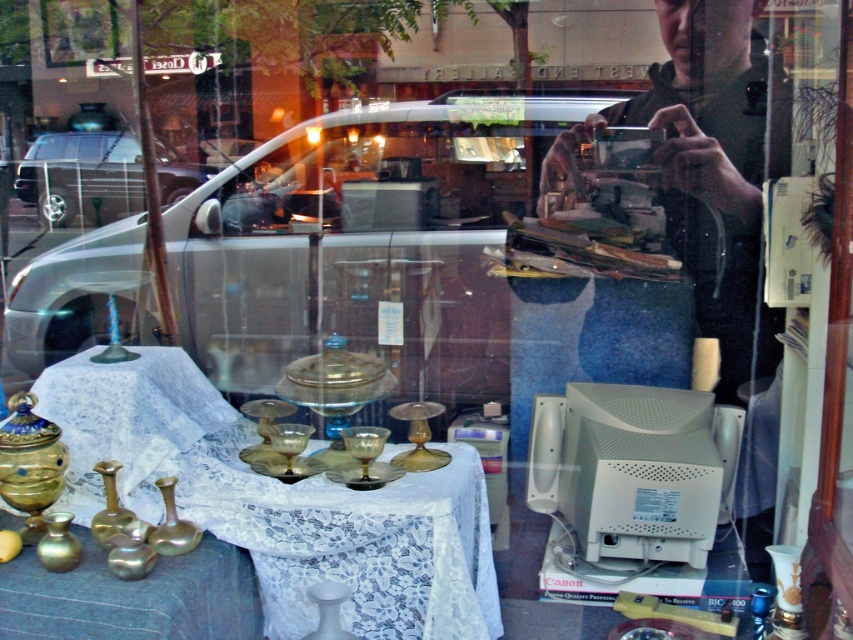
Can you confirm if white lace tablecloth at lower left is positioned to the right of dark green shirt at upper right?

Incorrect, white lace tablecloth at lower left is not on the right side of dark green shirt at upper right.

Is white lace tablecloth at lower left taller than dark green shirt at upper right?

No.

This screenshot has height=640, width=853. In order to click on white lace tablecloth at lower left in this screenshot , I will do `click(279, 502)`.

Identify the location of white lace tablecloth at lower left. This screenshot has width=853, height=640. (279, 502).

Is the position of dark green shirt at upper right more distant than that of metallic silver van at left?

No, dark green shirt at upper right is closer to the viewer.

The height and width of the screenshot is (640, 853). What do you see at coordinates (709, 164) in the screenshot?
I see `dark green shirt at upper right` at bounding box center [709, 164].

The width and height of the screenshot is (853, 640). What are the coordinates of `dark green shirt at upper right` in the screenshot? It's located at (709, 164).

Between white lace tablecloth at lower left and metallic silver van at left, which one appears on the left side from the viewer's perspective?

Positioned to the left is metallic silver van at left.

Can you confirm if white lace tablecloth at lower left is thinner than metallic silver van at left?

No, white lace tablecloth at lower left is not thinner than metallic silver van at left.

Based on the photo, who is more forward, (263, 588) or (93, 152)?

Point (263, 588) is more forward.

Where is `white lace tablecloth at lower left`? Image resolution: width=853 pixels, height=640 pixels. white lace tablecloth at lower left is located at coordinates (279, 502).